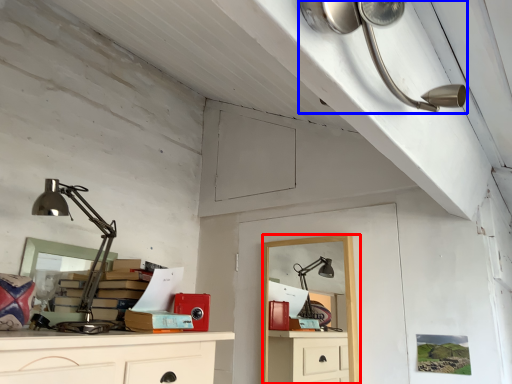
Question: Which of the following is the closest to the observer, computer desk (highlighted by a red box) or lamp (highlighted by a blue box)?

Choices:
 (A) computer desk
 (B) lamp

Answer: (B)